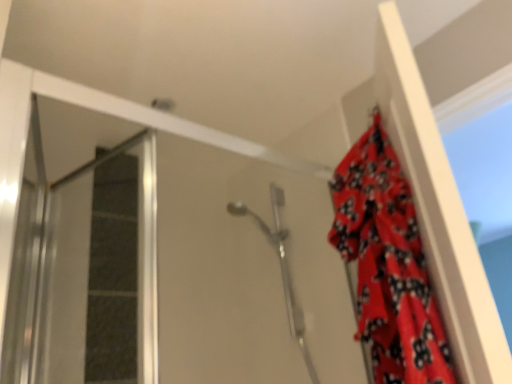
Question: Could you tell me if transparent glass screen door at left is facing red fabric curtain at upper right?

Choices:
 (A) yes
 (B) no

Answer: (B)

Question: From a real-world perspective, does transparent glass screen door at left stand above red fabric curtain at upper right?

Choices:
 (A) no
 (B) yes

Answer: (B)

Question: Is transparent glass screen door at left positioned far away from red fabric curtain at upper right?

Choices:
 (A) yes
 (B) no

Answer: (B)

Question: Considering the relative sizes of transparent glass screen door at left and red fabric curtain at upper right in the image provided, is transparent glass screen door at left bigger than red fabric curtain at upper right?

Choices:
 (A) yes
 (B) no

Answer: (B)

Question: Is transparent glass screen door at left next to red fabric curtain at upper right and touching it?

Choices:
 (A) no
 (B) yes

Answer: (A)

Question: Considering the relative sizes of transparent glass screen door at left and red fabric curtain at upper right in the image provided, is transparent glass screen door at left smaller than red fabric curtain at upper right?

Choices:
 (A) no
 (B) yes

Answer: (B)

Question: Is red fabric curtain at upper right thinner than satin silver shower head at center?

Choices:
 (A) yes
 (B) no

Answer: (A)

Question: Is red fabric curtain at upper right aimed at satin silver shower head at center?

Choices:
 (A) no
 (B) yes

Answer: (A)

Question: Considering the relative sizes of red fabric curtain at upper right and satin silver shower head at center in the image provided, is red fabric curtain at upper right shorter than satin silver shower head at center?

Choices:
 (A) no
 (B) yes

Answer: (B)

Question: Is red fabric curtain at upper right next to satin silver shower head at center?

Choices:
 (A) no
 (B) yes

Answer: (A)

Question: Can you confirm if red fabric curtain at upper right is smaller than satin silver shower head at center?

Choices:
 (A) yes
 (B) no

Answer: (A)

Question: Is satin silver shower head at center a part of red fabric curtain at upper right?

Choices:
 (A) yes
 (B) no

Answer: (B)

Question: Is satin silver shower head at center further to camera compared to red fabric curtain at upper right?

Choices:
 (A) yes
 (B) no

Answer: (A)